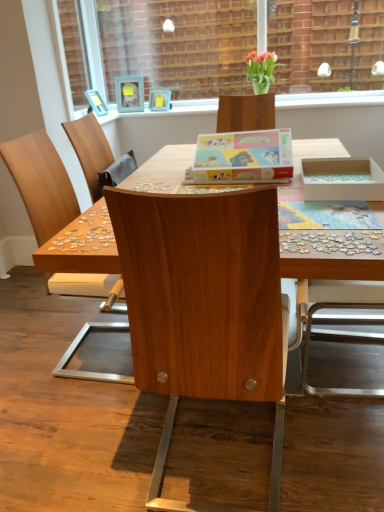
The image size is (384, 512). I want to click on free point below multicolored plastic puzzle pieces at right (from a real-world perspective), so click(345, 243).